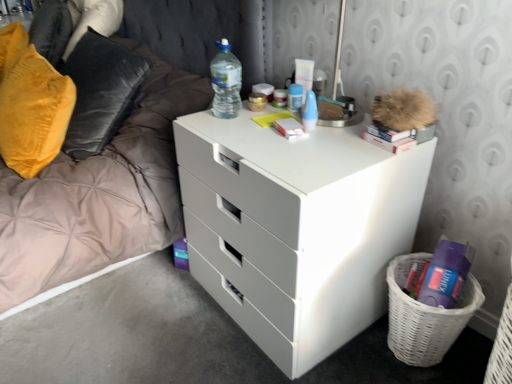
The image size is (512, 384). In order to click on vacant region to the left of white plastic tube at upper center, which is the 2th toiletry from front to back in this screenshot , I will do `click(257, 109)`.